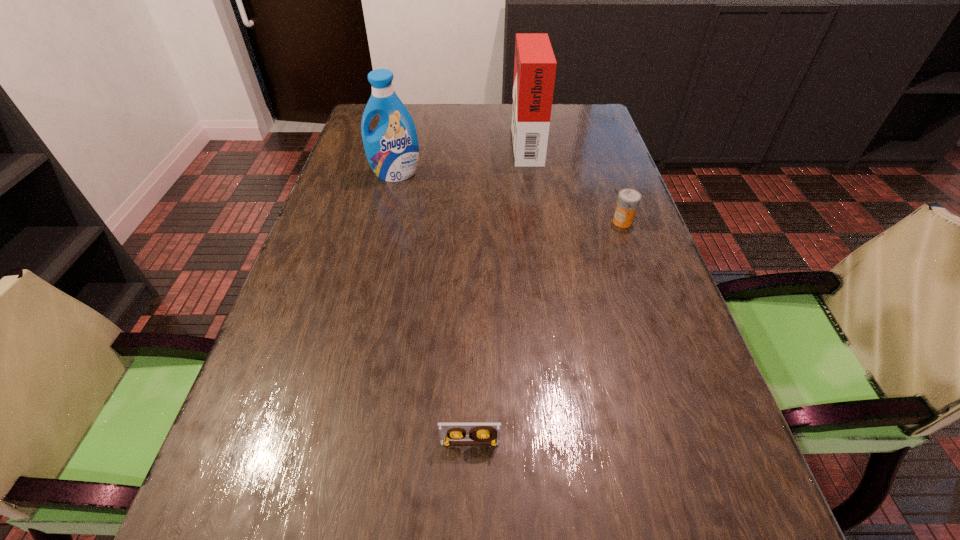
You are a GUI agent. You are given a task and a screenshot of the screen. Output one action in this format:
    pyautogui.click(x=<x>, y=<y>)
    Task: Click on the vacant space at the left edge
    The height and width of the screenshot is (540, 960).
    Given the screenshot: What is the action you would take?
    tap(331, 256)

I want to click on free location at the right edge, so click(596, 154).

Where is `vacant area that lies between the medicine and the shortest object`? vacant area that lies between the medicine and the shortest object is located at coordinates click(546, 332).

Locate an element on the screen. The width and height of the screenshot is (960, 540). unoccupied position between the shortest object and the third object from left to right is located at coordinates (x=498, y=293).

The width and height of the screenshot is (960, 540). Identify the location of free point between the rightmost object and the nearest object. (546, 332).

The height and width of the screenshot is (540, 960). Identify the location of vacant area between the second shortest object and the videotape. (546, 332).

Where is `unoccupied position between the shortest object and the medicine`? unoccupied position between the shortest object and the medicine is located at coordinates (546, 332).

This screenshot has height=540, width=960. I want to click on vacant space that's between the second shortest object and the leftmost object, so tap(509, 198).

Identify the location of empty space between the second object from right to left and the shortest object. (498, 293).

At what (x,y) coordinates should I click in order to perform the action: click on vacant region between the farthest object and the medicine. Please return your answer as a coordinate pair (x, y). Looking at the image, I should click on (574, 182).